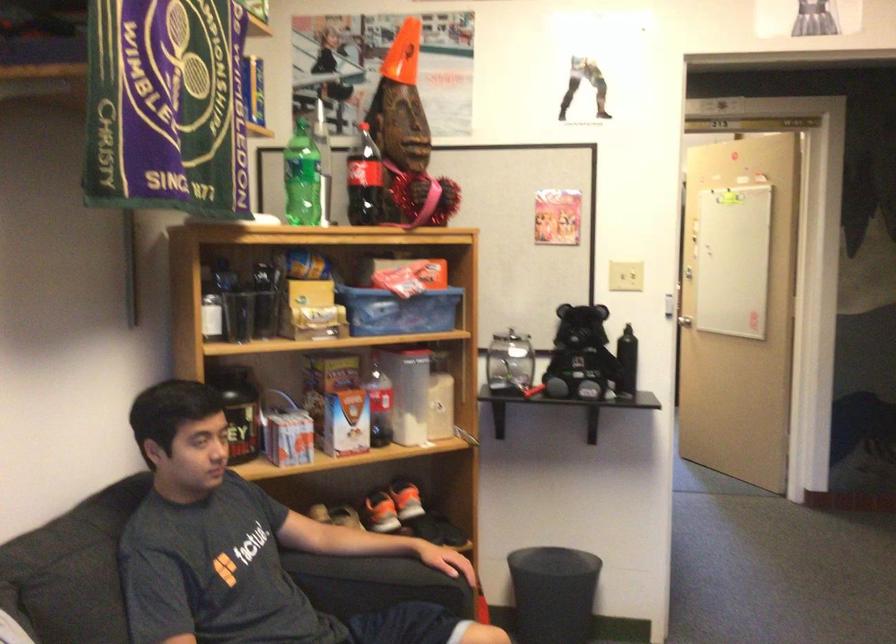
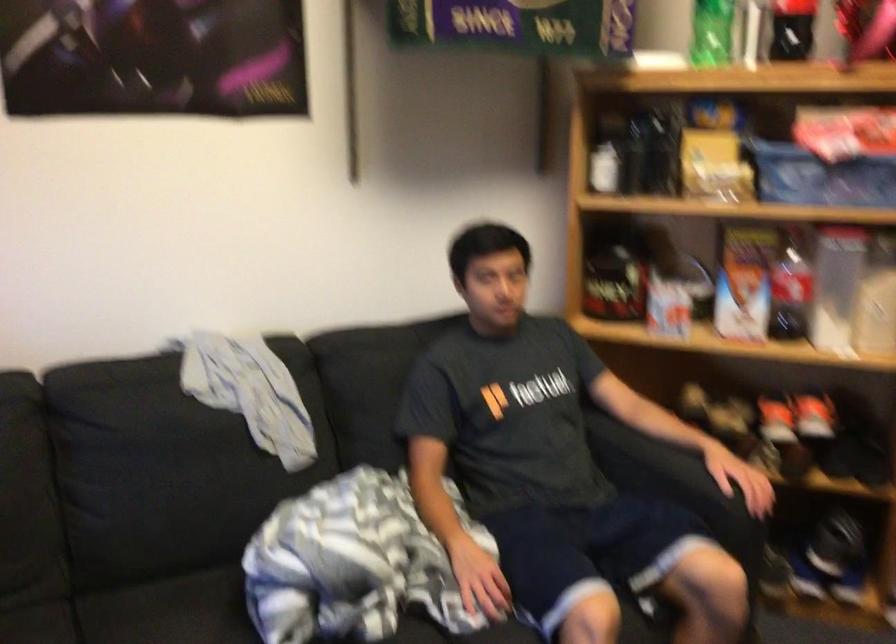
Locate, in the second image, the point that corresponds to (x=400, y=398) in the first image.

(836, 287)